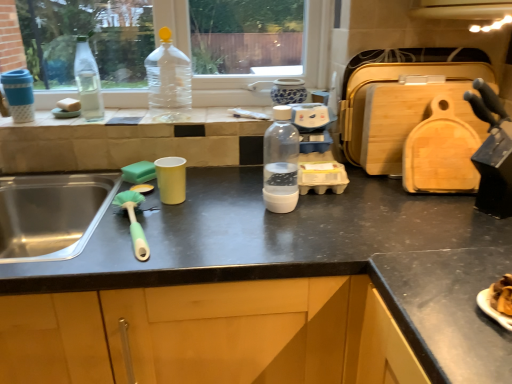
The height and width of the screenshot is (384, 512). What are the coordinates of `vacant area that lies between transparent plastic bottle at center, arranged as the first bottle when viewed from the front, and green sponge at left, the 1th food from the bottom` in the screenshot? It's located at (216, 195).